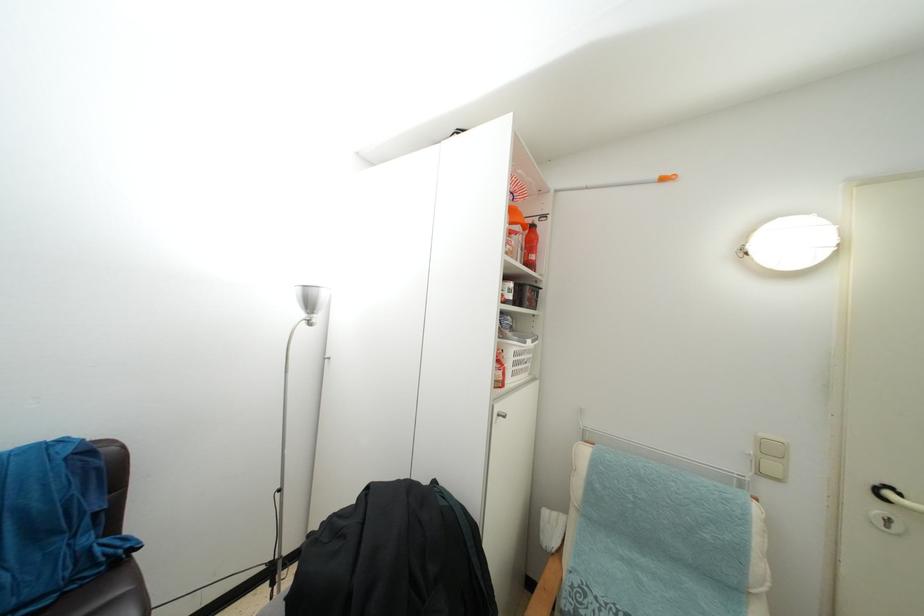
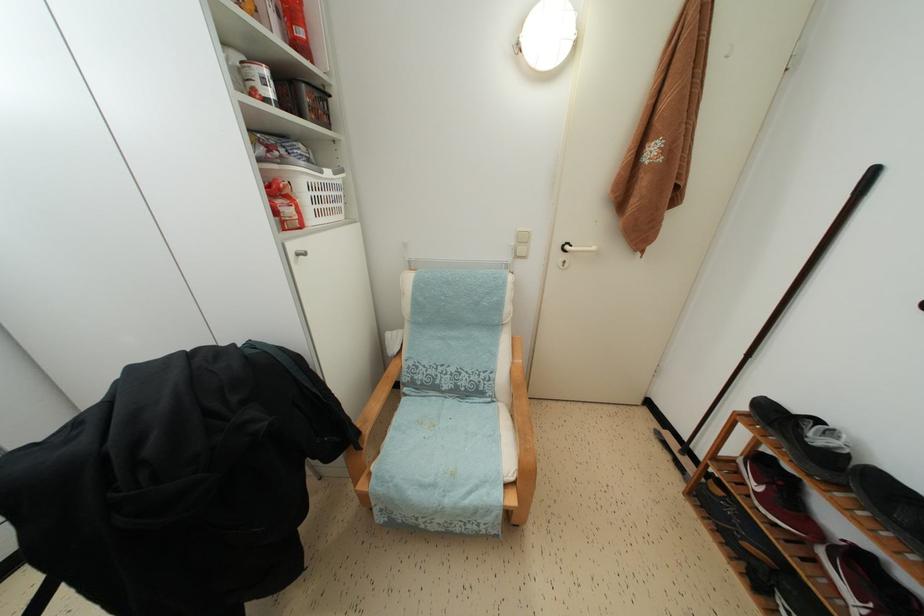
The point at (515,302) is marked in the first image. Where is the corresponding point in the second image?

(274, 100)